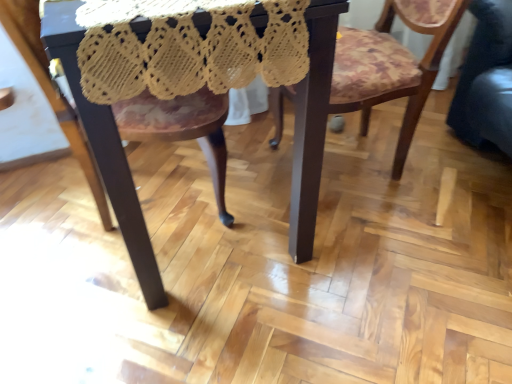
Image resolution: width=512 pixels, height=384 pixels. In order to click on free space to the left of wooden chair at center, which is counted as the first chair, starting from the left in this screenshot , I will do `click(38, 213)`.